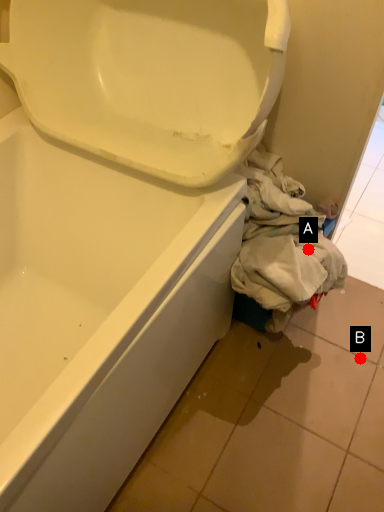
Question: Two points are circled on the image, labeled by A and B beside each circle. Which point is closer to the camera?

Choices:
 (A) A is closer
 (B) B is closer

Answer: (A)